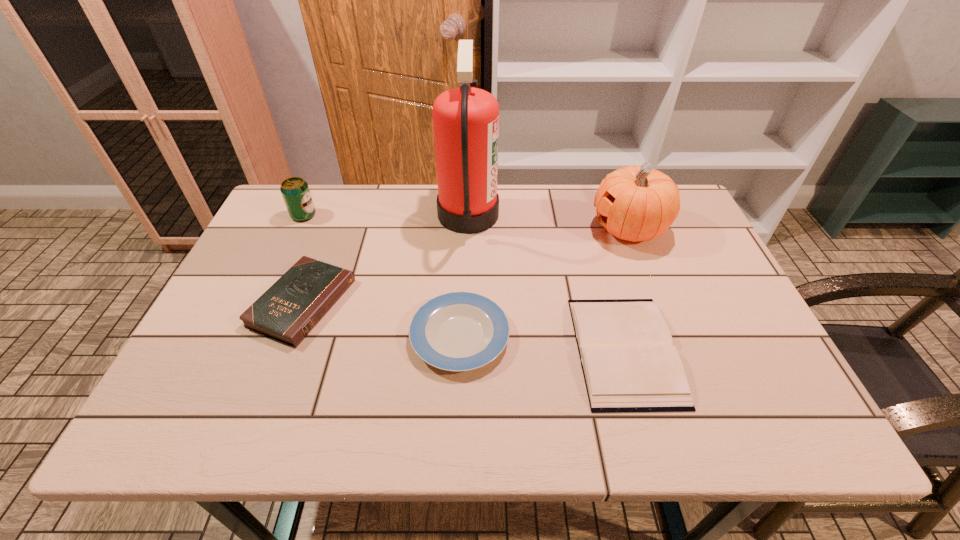
I want to click on fire extinguisher, so click(465, 120).

Find the location of a particular element. This screenshot has height=540, width=960. pumpkin is located at coordinates (636, 203).

The width and height of the screenshot is (960, 540). Find the location of `beer can`. beer can is located at coordinates (295, 191).

This screenshot has width=960, height=540. In order to click on Bible in this screenshot , I will do `click(288, 311)`.

Locate an element on the screen. Image resolution: width=960 pixels, height=540 pixels. hardback book is located at coordinates (629, 364).

Where is `plate`? The height and width of the screenshot is (540, 960). plate is located at coordinates (458, 331).

I want to click on free space located at the nozzle of the fire extinguisher, so click(x=528, y=214).

At what (x,y) coordinates should I click in order to perform the action: click on vacant space positioned 0.220m on the front-facing side of the second tallest object. Please return your answer as a coordinate pair (x, y). Looking at the image, I should click on (516, 228).

Identify the location of vacant space positioned on the front-facing side of the second tallest object. (567, 228).

I want to click on vacant area situated 0.240m on the front-facing side of the second tallest object, so click(x=510, y=228).